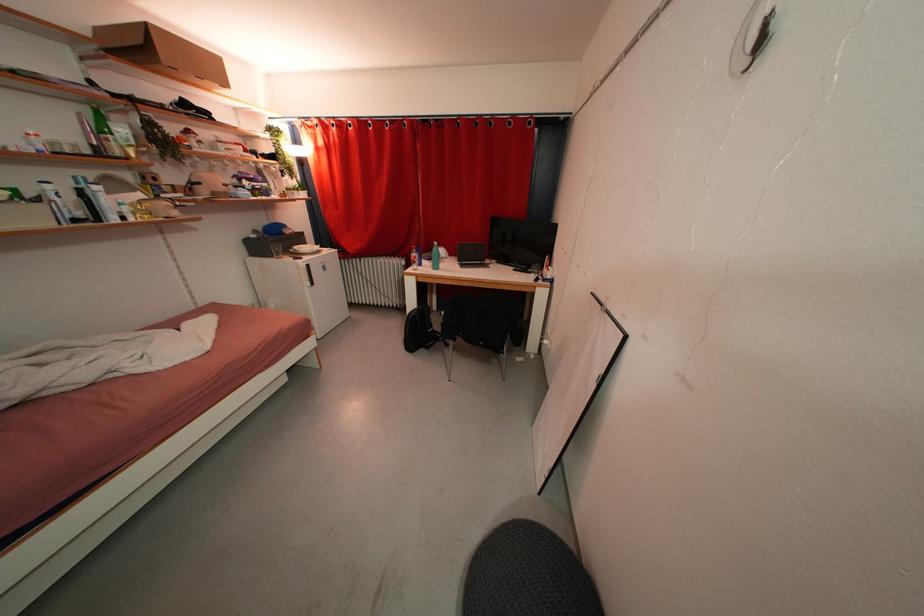
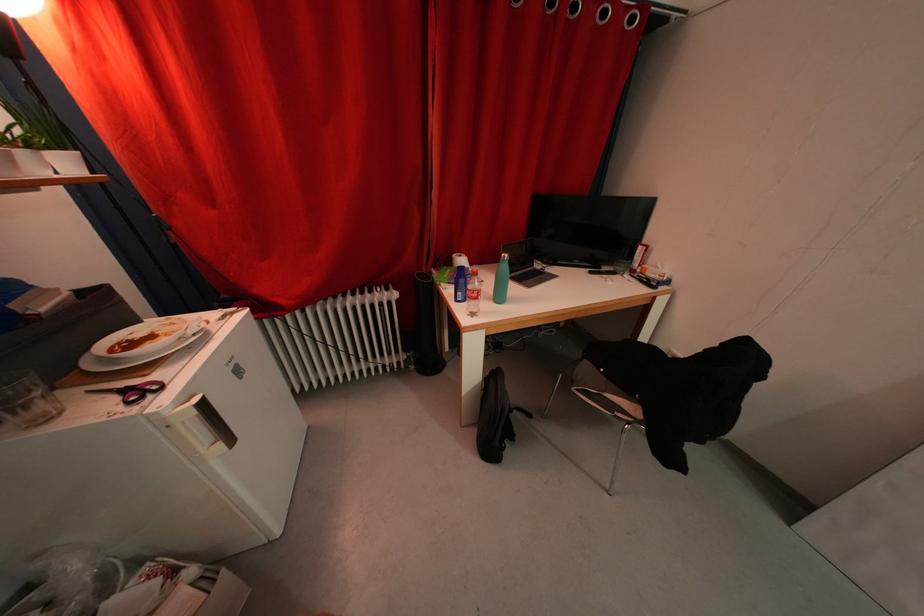
What movement of the cameraman would produce the second image?

The movement direction of the cameraman is left, forward.